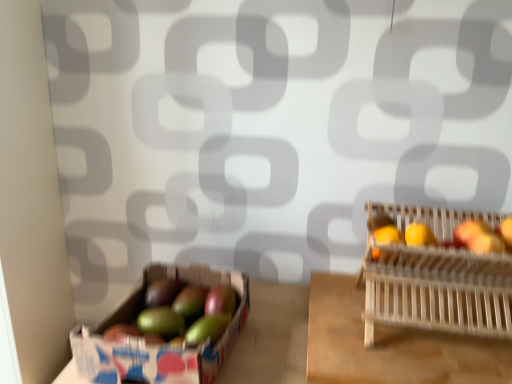
How much space does green matte avocado at lower left, arranged as the first apple when viewed from the left, occupy horizontally?

green matte avocado at lower left, arranged as the first apple when viewed from the left, is 2.51 inches wide.

How much space does green matte avocado at lower left, arranged as the 5th apple when viewed from the right, occupy vertically?

2.81 inches.

The height and width of the screenshot is (384, 512). I want to click on wooden slatted basket at right, so click(437, 290).

Locate an element on the screen. green matte mango at lower left, which ranks as the 4th apple in right-to-left order is located at coordinates (190, 302).

What do you see at coordinates (486, 243) in the screenshot? The width and height of the screenshot is (512, 384). I see `shiny red apple at right, which is the 2th apple from right to left` at bounding box center [486, 243].

What is the approximate width of shiny red apple at right, placed as the first apple when sorted from right to left?

2.13 inches.

The height and width of the screenshot is (384, 512). What do you see at coordinates (158, 345) in the screenshot?
I see `green matte mangoes at left` at bounding box center [158, 345].

I want to click on green matte avocado at lower left, arranged as the 5th apple when viewed from the right, so click(162, 292).

In the scene shown: From a real-world perspective, does green matte avocado at lower left, arranged as the first apple when viewed from the left, stand above shiny red apple at right, placed as the first apple when sorted from right to left?

Actually, green matte avocado at lower left, arranged as the first apple when viewed from the left, is physically below shiny red apple at right, placed as the first apple when sorted from right to left, in the real world.

Can we say green matte avocado at lower left, arranged as the 5th apple when viewed from the right, lies outside shiny red apple at right, the fifth apple viewed from the left?

That's correct, green matte avocado at lower left, arranged as the 5th apple when viewed from the right, is outside of shiny red apple at right, the fifth apple viewed from the left.

Considering the sizes of objects green matte avocado at lower left, arranged as the first apple when viewed from the left, and shiny red apple at right, the fifth apple viewed from the left, in the image provided, who is taller, green matte avocado at lower left, arranged as the first apple when viewed from the left, or shiny red apple at right, the fifth apple viewed from the left,?

With more height is green matte avocado at lower left, arranged as the first apple when viewed from the left.

Considering the positions of objects wooden slatted basket at right and green matte mango at lower left, which ranks as the 4th apple in right-to-left order, in the image provided, who is more to the right, wooden slatted basket at right or green matte mango at lower left, which ranks as the 4th apple in right-to-left order,?

From the viewer's perspective, wooden slatted basket at right appears more on the right side.

Could you measure the distance between wooden slatted basket at right and green matte mango at lower left, positioned as the second apple in left-to-right order?

wooden slatted basket at right and green matte mango at lower left, positioned as the second apple in left-to-right order, are 20.91 inches apart.

Considering the relative sizes of wooden slatted basket at right and green matte mango at lower left, which ranks as the 4th apple in right-to-left order, in the image provided, is wooden slatted basket at right taller than green matte mango at lower left, which ranks as the 4th apple in right-to-left order,?

Correct, wooden slatted basket at right is much taller as green matte mango at lower left, which ranks as the 4th apple in right-to-left order.

Is wooden slatted basket at right in contact with green matte mango at lower left, positioned as the second apple in left-to-right order?

No, wooden slatted basket at right is not in contact with green matte mango at lower left, positioned as the second apple in left-to-right order.

From the picture: From a real-world perspective, between shiny red apple at right, which is the 2th apple from right to left, and green matte avocado at lower left, arranged as the first apple when viewed from the left, who is vertically higher?

In real-world perspective, shiny red apple at right, which is the 2th apple from right to left, is above.

Is shiny red apple at right, which is the 2th apple from right to left, far away from green matte avocado at lower left, arranged as the first apple when viewed from the left?

They are positioned close to each other.

How many degrees apart are the facing directions of shiny red apple at right, which is the 2th apple from right to left, and green matte avocado at lower left, arranged as the 5th apple when viewed from the right?

The angular difference between shiny red apple at right, which is the 2th apple from right to left, and green matte avocado at lower left, arranged as the 5th apple when viewed from the right, is 10.9 degrees.

Does point (486, 245) appear closer or farther from the camera than point (159, 287)?

Clearly, point (486, 245) is closer to the camera than point (159, 287).

How different are the orientations of green matte mango at lower left, which ranks as the 4th apple in right-to-left order, and shiny red apple at right, placed as the first apple when sorted from right to left, in degrees?

green matte mango at lower left, which ranks as the 4th apple in right-to-left order, and shiny red apple at right, placed as the first apple when sorted from right to left, are facing 10.9 degrees away from each other.

Based on the photo, from the image's perspective, is green matte mango at lower left, which ranks as the 4th apple in right-to-left order, below shiny red apple at right, placed as the first apple when sorted from right to left?

Indeed, from the image's perspective, green matte mango at lower left, which ranks as the 4th apple in right-to-left order, is shown beneath shiny red apple at right, placed as the first apple when sorted from right to left.

Considering the sizes of green matte mango at lower left, positioned as the second apple in left-to-right order, and shiny red apple at right, placed as the first apple when sorted from right to left, in the image, is green matte mango at lower left, positioned as the second apple in left-to-right order, bigger or smaller than shiny red apple at right, placed as the first apple when sorted from right to left,?

In the image, green matte mango at lower left, positioned as the second apple in left-to-right order, appears to be larger than shiny red apple at right, placed as the first apple when sorted from right to left.

From the image's perspective, is green matte apple at center, arranged as the third apple when viewed from the left, on top of green matte avocado at lower left, arranged as the first apple when viewed from the left?

Incorrect, from the image's perspective, green matte apple at center, arranged as the third apple when viewed from the left, is lower than green matte avocado at lower left, arranged as the first apple when viewed from the left.

Could you tell me if green matte apple at center, arranged as the third apple when viewed from the left, is turned towards green matte avocado at lower left, arranged as the 5th apple when viewed from the right?

No, green matte apple at center, arranged as the third apple when viewed from the left, is not aimed at green matte avocado at lower left, arranged as the 5th apple when viewed from the right.

Considering the relative sizes of green matte apple at center, which is the 3th apple from right to left, and green matte avocado at lower left, arranged as the 5th apple when viewed from the right, in the image provided, is green matte apple at center, which is the 3th apple from right to left, bigger than green matte avocado at lower left, arranged as the 5th apple when viewed from the right,?

No, green matte apple at center, which is the 3th apple from right to left, is not bigger than green matte avocado at lower left, arranged as the 5th apple when viewed from the right.

Do you think shiny red apple at right, the fourth apple viewed from the left, is within wooden slatted basket at right, or outside of it?

shiny red apple at right, the fourth apple viewed from the left, lies within the bounds of wooden slatted basket at right.

Is shiny red apple at right, which is the 2th apple from right to left, not near wooden slatted basket at right?

No, shiny red apple at right, which is the 2th apple from right to left, is in close proximity to wooden slatted basket at right.

Is shiny red apple at right, which is the 2th apple from right to left, in front of or behind wooden slatted basket at right in the image?

Clearly, shiny red apple at right, which is the 2th apple from right to left, is behind wooden slatted basket at right.

Considering the relative sizes of shiny red apple at right, the fourth apple viewed from the left, and wooden slatted basket at right in the image provided, is shiny red apple at right, the fourth apple viewed from the left, thinner than wooden slatted basket at right?

Indeed, shiny red apple at right, the fourth apple viewed from the left, has a lesser width compared to wooden slatted basket at right.

Looking at this image, does green matte mangoes at left have a larger size compared to wooden slatted basket at right?

Actually, green matte mangoes at left might be smaller than wooden slatted basket at right.

Looking at this image, is green matte mangoes at left situated inside wooden slatted basket at right or outside?

green matte mangoes at left lies outside wooden slatted basket at right.

Is green matte mangoes at left aimed at wooden slatted basket at right?

No, green matte mangoes at left is not turned towards wooden slatted basket at right.

From a real-world perspective, is green matte mangoes at left on wooden slatted basket at right?

Actually, green matte mangoes at left is physically below wooden slatted basket at right in the real world.

Locate an element on the screen. the 4th apple to the right when counting from the green matte avocado at lower left, arranged as the 5th apple when viewed from the right is located at coordinates (469, 231).

There is a wooden slatted basket at right. What are the coordinates of `the 2nd apple below it (from the image's perspective)` in the screenshot? It's located at (190, 302).

Considering their positions, is green matte avocado at lower left, arranged as the first apple when viewed from the left, positioned further to shiny red apple at right, which is the 2th apple from right to left, than wooden slatted basket at right?

green matte avocado at lower left, arranged as the first apple when viewed from the left, lies further to shiny red apple at right, which is the 2th apple from right to left, than the other object.

In the scene shown: When comparing their distances from green matte mangoes at left, does wooden slatted basket at right or green matte avocado at lower left, arranged as the 5th apple when viewed from the right, seem further?

wooden slatted basket at right is further to green matte mangoes at left.

Based on their spatial positions, is green matte apple at center, arranged as the third apple when viewed from the left, or green matte avocado at lower left, arranged as the first apple when viewed from the left, further from green matte mangoes at left?

green matte apple at center, arranged as the third apple when viewed from the left, lies further to green matte mangoes at left than the other object.

Considering their positions, is green matte apple at center, which is the 3th apple from right to left, positioned closer to shiny red apple at right, placed as the first apple when sorted from right to left, than shiny red apple at right, the fourth apple viewed from the left?

shiny red apple at right, the fourth apple viewed from the left, is positioned closer to the anchor shiny red apple at right, placed as the first apple when sorted from right to left.

Estimate the real-world distances between objects in this image. Which object is further from shiny red apple at right, the fifth apple viewed from the left, green matte mangoes at left or wooden slatted basket at right?

The object further to shiny red apple at right, the fifth apple viewed from the left, is green matte mangoes at left.

Estimate the real-world distances between objects in this image. Which object is closer to shiny red apple at right, the fourth apple viewed from the left, green matte mango at lower left, which ranks as the 4th apple in right-to-left order, or green matte mangoes at left?

green matte mango at lower left, which ranks as the 4th apple in right-to-left order.

Based on their spatial positions, is green matte mangoes at left or shiny red apple at right, the fourth apple viewed from the left, further from green matte avocado at lower left, arranged as the 5th apple when viewed from the right?

Based on the image, shiny red apple at right, the fourth apple viewed from the left, appears to be further to green matte avocado at lower left, arranged as the 5th apple when viewed from the right.

Based on their spatial positions, is shiny red apple at right, which is the 2th apple from right to left, or green matte mangoes at left further from green matte avocado at lower left, arranged as the 5th apple when viewed from the right?

The object further to green matte avocado at lower left, arranged as the 5th apple when viewed from the right, is shiny red apple at right, which is the 2th apple from right to left.

The height and width of the screenshot is (384, 512). In order to click on basket situated between green matte apple at center, which is the 3th apple from right to left, and shiny red apple at right, which is the 2th apple from right to left, from left to right in this screenshot , I will do `click(437, 290)`.

Where is `basket between green matte apple at center, arranged as the third apple when viewed from the left, and shiny red apple at right, placed as the first apple when sorted from right to left`? Image resolution: width=512 pixels, height=384 pixels. basket between green matte apple at center, arranged as the third apple when viewed from the left, and shiny red apple at right, placed as the first apple when sorted from right to left is located at coordinates (437, 290).

Where is `basket between green matte mangoes at left and shiny red apple at right, which is the 2th apple from right to left, in the horizontal direction`? basket between green matte mangoes at left and shiny red apple at right, which is the 2th apple from right to left, in the horizontal direction is located at coordinates (437, 290).

I want to click on basket between green matte avocado at lower left, arranged as the first apple when viewed from the left, and shiny red apple at right, which is the 2th apple from right to left, from left to right, so click(437, 290).